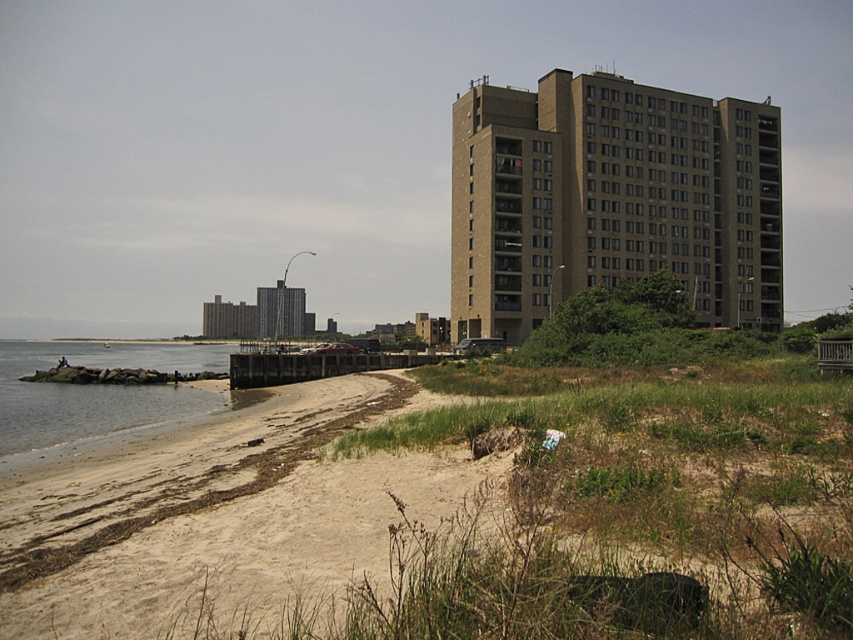
Who is more distant from viewer, [0,380] or [268,312]?

The point [268,312] is behind.

Does clear water at lower left have a greater width compared to dark gray concrete building at center?

Indeed, clear water at lower left has a greater width compared to dark gray concrete building at center.

Where is `clear water at lower left`? clear water at lower left is located at coordinates (97, 390).

The height and width of the screenshot is (640, 853). Find the location of `clear water at lower left`. clear water at lower left is located at coordinates [x=97, y=390].

Who is higher up, sandy beach at lower left or clear water at lower left?

sandy beach at lower left is above.

How distant is sandy beach at lower left from clear water at lower left?

sandy beach at lower left is 57.53 meters from clear water at lower left.

Is point (572, 413) more distant than point (129, 397)?

That is False.

Identify the location of sandy beach at lower left. The image size is (853, 640). (509, 525).

Does brown brick building at upper right have a greater height compared to clear water at lower left?

Yes, brown brick building at upper right is taller than clear water at lower left.

Does point (720, 198) lie in front of point (1, 352)?

Yes, point (720, 198) is in front of point (1, 352).

This screenshot has height=640, width=853. Identify the location of brown brick building at upper right. (611, 200).